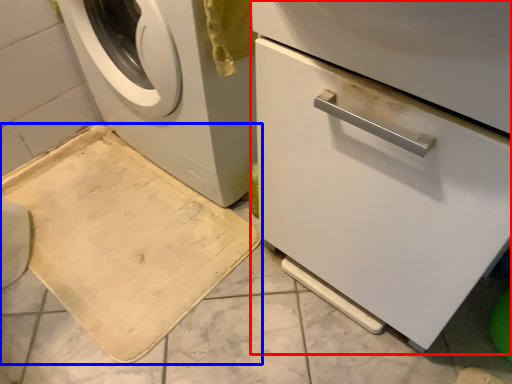
Question: Which object is further to the camera taking this photo, machine (highlighted by a red box) or bath mat (highlighted by a blue box)?

Choices:
 (A) machine
 (B) bath mat

Answer: (B)